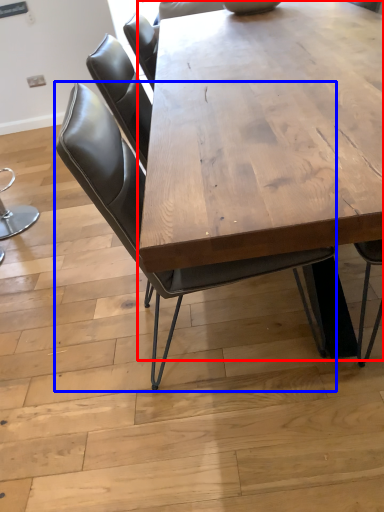
Question: Which point is further to the camera, coffee table (highlighted by a red box) or chair (highlighted by a blue box)?

Choices:
 (A) coffee table
 (B) chair

Answer: (B)